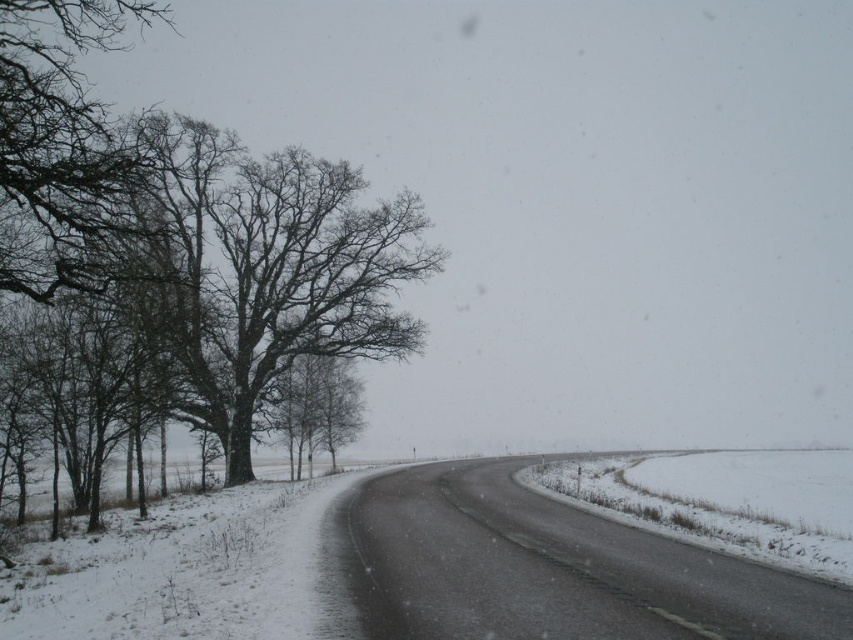
Question: Which of the following is the closest to the observer?

Choices:
 (A) dark brown bark tree at left
 (B) bare branches at left

Answer: (B)

Question: Does dark brown bark tree at left have a greater width compared to bare branches at left?

Choices:
 (A) yes
 (B) no

Answer: (B)

Question: Is dark brown bark tree at left positioned in front of bare branches at left?

Choices:
 (A) yes
 (B) no

Answer: (B)

Question: From the image, what is the correct spatial relationship of dark brown bark tree at left in relation to bare branches at left?

Choices:
 (A) below
 (B) above

Answer: (A)